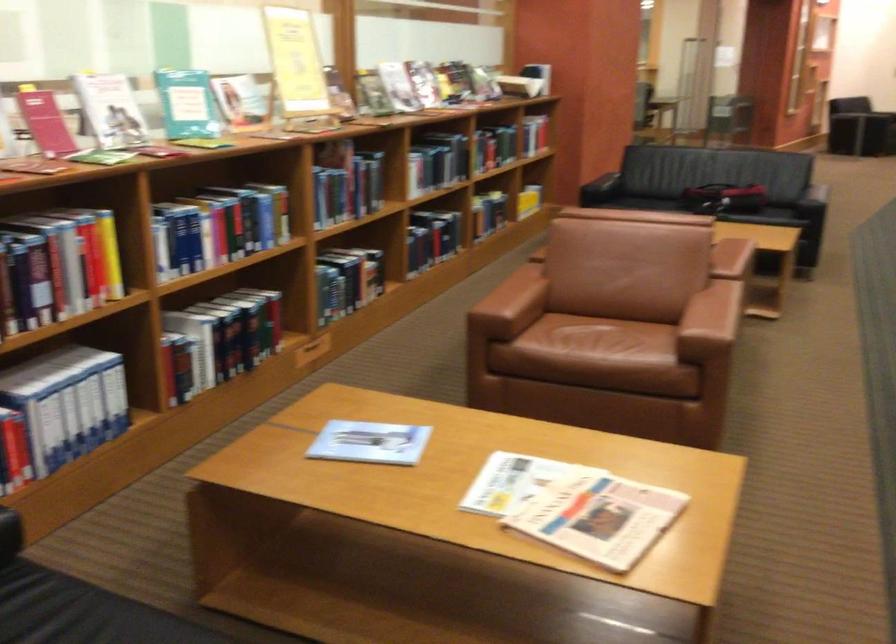
Where would you sit the brown chair sitting surface? Please return your answer as a coordinate pair (x, y).

(599, 342)